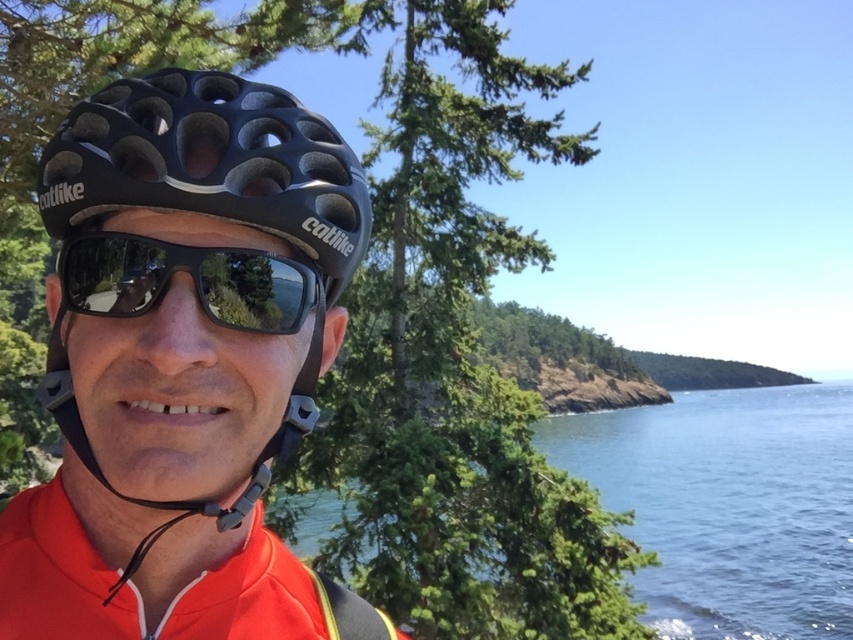
You are a cyclist wearing a black Catlike cycling helmet with multiple ventilation holes and dark sunglasses. You notice a point at coordinates (196, 246) in your field of view. What object is located at that point?

Result: The point at coordinates (196, 246) corresponds to the black matte bicycle helmet at center.

You are a cyclist wearing a black Catlike cycling helmet at center and a red cycling jersey. You notice a small rock at point (196, 246). Is the rock on your helmet or on your jersey?

The point (196, 246) is on the black matte bicycle helmet at center, so the rock is on your helmet.

You are standing at the point with coordinates point [276,310] and want to move towards the point with coordinates point [245,145]. Which direction should you face to move towards it?

You should face towards the direction of point [245,145], which is in front of point [276,310].